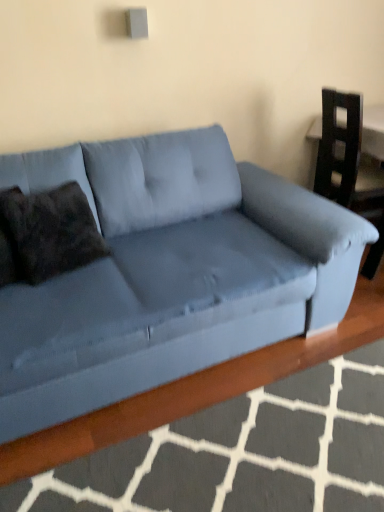
Question: Considering their positions, is velvet blue couch at center located in front of or behind matte blue armchair at right?

Choices:
 (A) front
 (B) behind

Answer: (A)

Question: Is velvet blue couch at center to the left or to the right of matte blue armchair at right in the image?

Choices:
 (A) right
 (B) left

Answer: (B)

Question: Estimate the real-world distances between objects in this image. Which object is farther from the matte blue armchair at right?

Choices:
 (A) dark brown textured pillow at left
 (B) velvet blue couch at center

Answer: (A)

Question: Which of these objects is positioned farthest from the dark brown textured pillow at left?

Choices:
 (A) matte blue armchair at right
 (B) velvet blue couch at center

Answer: (A)